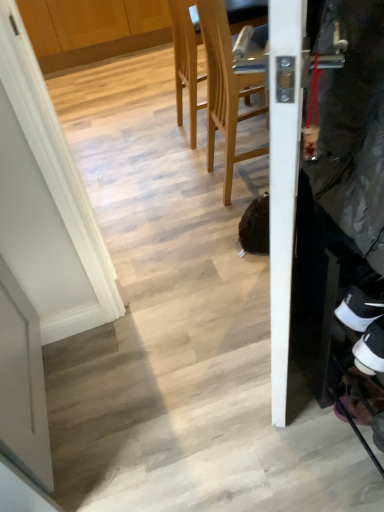
What do you see at coordinates (370, 349) in the screenshot? The width and height of the screenshot is (384, 512). I see `white suede sneaker at lower right` at bounding box center [370, 349].

Where is `wooden at center, the 2th chair when ordered from back to front`? This screenshot has width=384, height=512. wooden at center, the 2th chair when ordered from back to front is located at coordinates (224, 90).

Is white suede sneaker at lower right not inside light wood chair at upper center, marked as the 1th chair in a back-to-front arrangement?

Yes, white suede sneaker at lower right is located beyond the bounds of light wood chair at upper center, marked as the 1th chair in a back-to-front arrangement.

In the scene shown: How many degrees apart are the facing directions of white suede sneaker at lower right and light wood chair at upper center, marked as the 1th chair in a back-to-front arrangement?

The angle between the facing direction of white suede sneaker at lower right and the facing direction of light wood chair at upper center, marked as the 1th chair in a back-to-front arrangement, is 177 degrees.

Visually, is white suede sneaker at lower right positioned to the left or to the right of light wood chair at upper center, which is the second chair from front to back?

In the image, white suede sneaker at lower right appears on the right side of light wood chair at upper center, which is the second chair from front to back.

Based on the photo, how different are the orientations of white suede sneaker at lower right and wooden at center, acting as the first chair starting from the front, in degrees?

There is a 177-degree angle between the facing directions of white suede sneaker at lower right and wooden at center, acting as the first chair starting from the front.

Considering the sizes of objects white suede sneaker at lower right and wooden at center, the 2th chair when ordered from back to front, in the image provided, who is taller, white suede sneaker at lower right or wooden at center, the 2th chair when ordered from back to front,?

With more height is wooden at center, the 2th chair when ordered from back to front.

Is white suede sneaker at lower right in front of or behind wooden at center, acting as the first chair starting from the front, in the image?

white suede sneaker at lower right is in front of wooden at center, acting as the first chair starting from the front.

From the image's perspective, who appears lower, white suede sneaker at lower right or wooden at center, the 2th chair when ordered from back to front?

white suede sneaker at lower right.

From a real-world perspective, is light wood chair at upper center, which is the second chair from front to back, positioned over wooden at center, acting as the first chair starting from the front, based on gravity?

No, from a real-world perspective, light wood chair at upper center, which is the second chair from front to back, is not over wooden at center, acting as the first chair starting from the front

Which of these two, light wood chair at upper center, which is the second chair from front to back, or wooden at center, the 2th chair when ordered from back to front, stands taller?

Standing taller between the two is wooden at center, the 2th chair when ordered from back to front.

Is light wood chair at upper center, marked as the 1th chair in a back-to-front arrangement, further to the viewer compared to wooden at center, the 2th chair when ordered from back to front?

Yes, light wood chair at upper center, marked as the 1th chair in a back-to-front arrangement, is further from the viewer.

This screenshot has height=512, width=384. I want to click on chair above the wooden at center, the 2th chair when ordered from back to front (from the image's perspective), so click(x=185, y=62).

Is light wood chair at upper center, marked as the 1th chair in a back-to-front arrangement, thinner than white suede sneaker at lower right?

In fact, light wood chair at upper center, marked as the 1th chair in a back-to-front arrangement, might be wider than white suede sneaker at lower right.

Is there a large distance between light wood chair at upper center, marked as the 1th chair in a back-to-front arrangement, and white suede sneaker at lower right?

Absolutely, light wood chair at upper center, marked as the 1th chair in a back-to-front arrangement, is distant from white suede sneaker at lower right.

Is light wood chair at upper center, marked as the 1th chair in a back-to-front arrangement, taller or shorter than white suede sneaker at lower right?

In the image, light wood chair at upper center, marked as the 1th chair in a back-to-front arrangement, appears to be taller than white suede sneaker at lower right.

Find the location of a particular element. The width and height of the screenshot is (384, 512). chair that is behind the wooden at center, acting as the first chair starting from the front is located at coordinates (185, 62).

Is wooden at center, the 2th chair when ordered from back to front, aimed at light wood chair at upper center, marked as the 1th chair in a back-to-front arrangement?

No.

From the image's perspective, is wooden at center, the 2th chair when ordered from back to front, located above light wood chair at upper center, which is the second chair from front to back?

Incorrect, from the image's perspective, wooden at center, the 2th chair when ordered from back to front, is lower than light wood chair at upper center, which is the second chair from front to back.

Find the location of a particular element. the 1st chair to the left of the white suede sneaker at lower right, counting from the anchor's position is located at coordinates (224, 90).

Is point (247, 93) in front of point (364, 348)?

No, it is not.

Identify the location of footwear in front of the light wood chair at upper center, marked as the 1th chair in a back-to-front arrangement. This screenshot has height=512, width=384. (370, 349).

Locate an element on the screen. The image size is (384, 512). footwear below the wooden at center, acting as the first chair starting from the front (from the image's perspective) is located at coordinates (370, 349).

Based on their spatial positions, is wooden at center, the 2th chair when ordered from back to front, or light wood chair at upper center, marked as the 1th chair in a back-to-front arrangement, further from white suede sneaker at lower right?

Among the two, light wood chair at upper center, marked as the 1th chair in a back-to-front arrangement, is located further to white suede sneaker at lower right.

From the image, which object appears to be nearer to wooden at center, acting as the first chair starting from the front, white suede sneaker at lower right or light wood chair at upper center, which is the second chair from front to back?

light wood chair at upper center, which is the second chair from front to back, is positioned closer to the anchor wooden at center, acting as the first chair starting from the front.

Looking at this image, which object lies nearer to the anchor point light wood chair at upper center, marked as the 1th chair in a back-to-front arrangement, white suede sneaker at lower right or wooden at center, the 2th chair when ordered from back to front?

wooden at center, the 2th chair when ordered from back to front, is closer to light wood chair at upper center, marked as the 1th chair in a back-to-front arrangement.

Considering their positions, is wooden at center, acting as the first chair starting from the front, positioned further to light wood chair at upper center, which is the second chair from front to back, than white suede sneaker at lower right?

white suede sneaker at lower right is further to light wood chair at upper center, which is the second chair from front to back.

Which object lies further to the anchor point white suede sneaker at lower right, light wood chair at upper center, which is the second chair from front to back, or wooden at center, acting as the first chair starting from the front?

Based on the image, light wood chair at upper center, which is the second chair from front to back, appears to be further to white suede sneaker at lower right.

Which object lies further to the anchor point wooden at center, the 2th chair when ordered from back to front, light wood chair at upper center, marked as the 1th chair in a back-to-front arrangement, or white suede sneaker at lower right?

white suede sneaker at lower right is positioned further to the anchor wooden at center, the 2th chair when ordered from back to front.

Locate an element on the screen. Image resolution: width=384 pixels, height=512 pixels. chair between light wood chair at upper center, which is the second chair from front to back, and white suede sneaker at lower right from top to bottom is located at coordinates (224, 90).